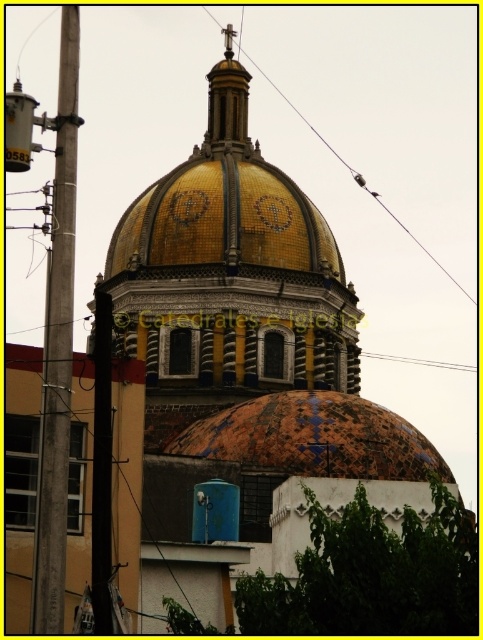
You are a maintenance worker needing to inspect both the gold mosaic dome at center and the metallic wire at upper center. Given that your ladder can extend up to 100 feet, will you need additional equipment to reach both objects?

The gold mosaic dome at center and metallic wire at upper center are 120.32 feet apart from each other, so the ladder that can extend up to 100 feet is insufficient. You will need additional equipment to reach both objects.